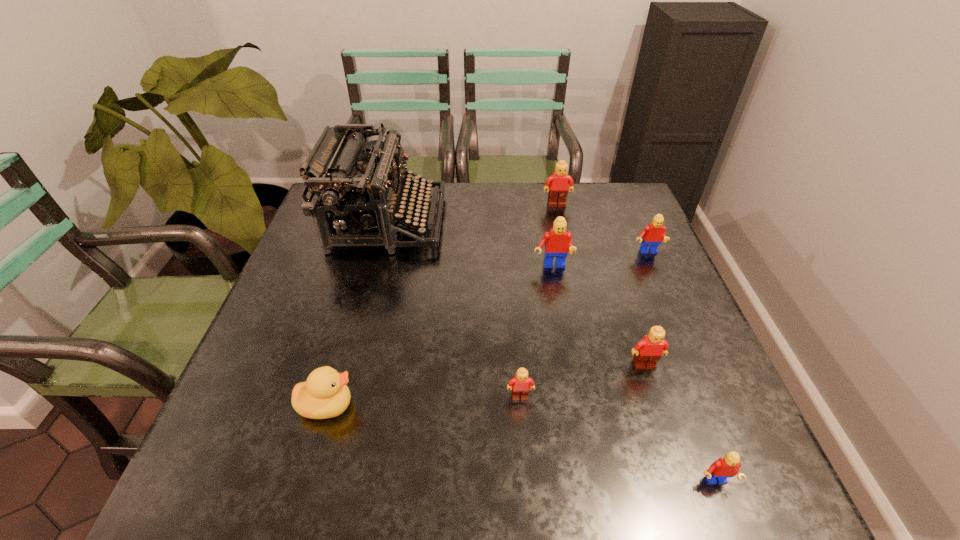
Identify which red Lego is the nearest to the nearest brown Lego. Please provide its 2D coordinates. Your answer should be formatted as a tuple, i.e. [(x, y)], where the tuple contains the x and y coordinates of a point satisfying the conditions above.

[(725, 467)]

Where is `vacant space that satisfies the following two spatial constraints: 1. on the face of the third object from left to right; 2. on the face of the yellow duckling`? vacant space that satisfies the following two spatial constraints: 1. on the face of the third object from left to right; 2. on the face of the yellow duckling is located at coordinates (520, 405).

What are the coordinates of `vacant area that satisfies the following two spatial constraints: 1. on the face of the leftmost Lego; 2. on the face of the yellow duckling` in the screenshot? It's located at (520, 405).